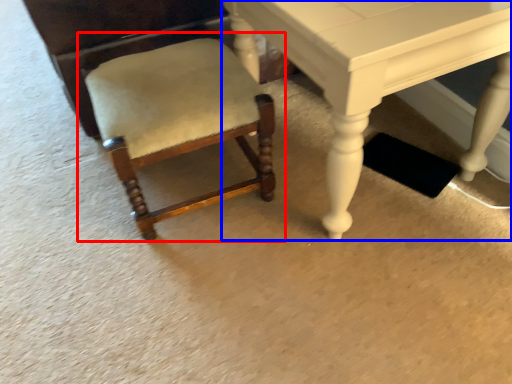
Question: Which point is further to the camera, chair (highlighted by a red box) or table (highlighted by a blue box)?

Choices:
 (A) chair
 (B) table

Answer: (A)